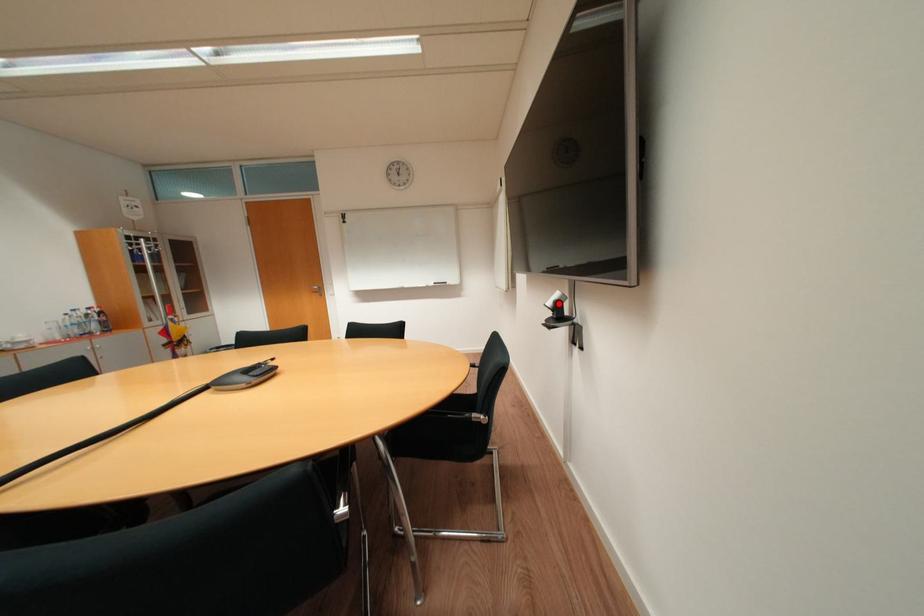
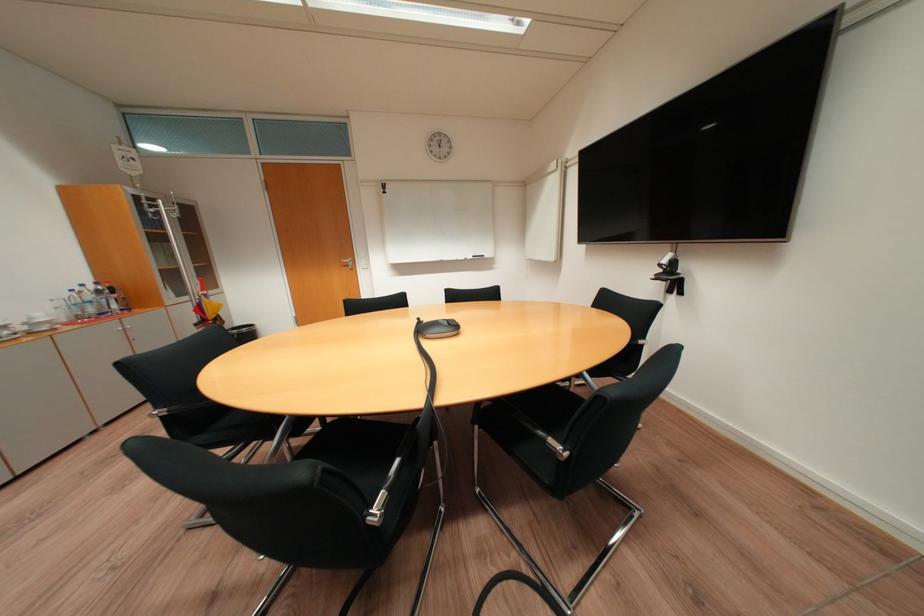
Locate, in the second image, the point that corresponds to the highlighted location in the first image.

(673, 262)